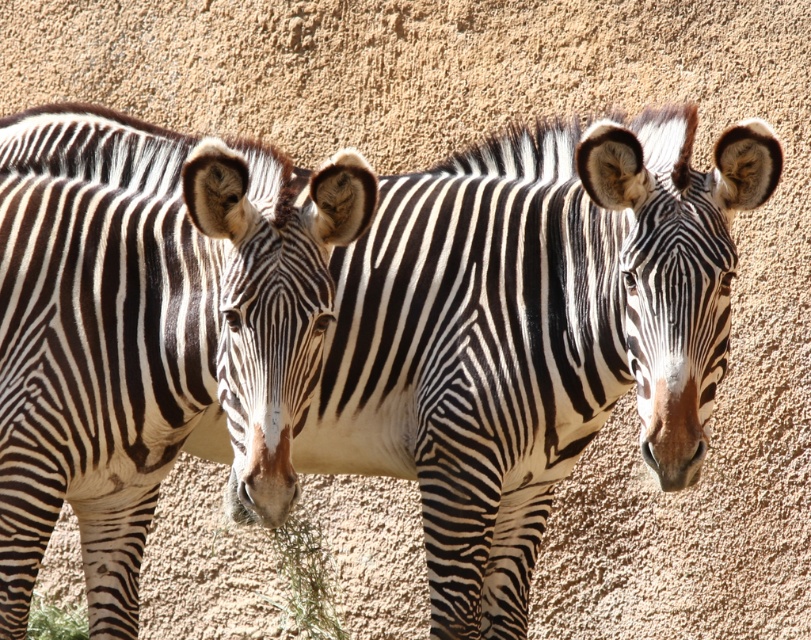
Where is `black and white striped zebra at left`? This screenshot has height=640, width=811. black and white striped zebra at left is located at coordinates (149, 330).

Measure the distance between green leafy grass at lower center and green leafy grass at lower left.

green leafy grass at lower center and green leafy grass at lower left are 74.03 centimeters apart from each other.

Can you confirm if green leafy grass at lower center is positioned below green leafy grass at lower left?

No, green leafy grass at lower center is not below green leafy grass at lower left.

Identify the location of green leafy grass at lower center. The image size is (811, 640). (305, 579).

Who is taller, black and white striped zebra at left or green leafy grass at lower left?

black and white striped zebra at left is taller.

Measure the distance between black and white striped zebra at left and camera.

A distance of 3.07 meters exists between black and white striped zebra at left and camera.

Where is `black and white striped zebra at left`? This screenshot has height=640, width=811. black and white striped zebra at left is located at coordinates (149, 330).